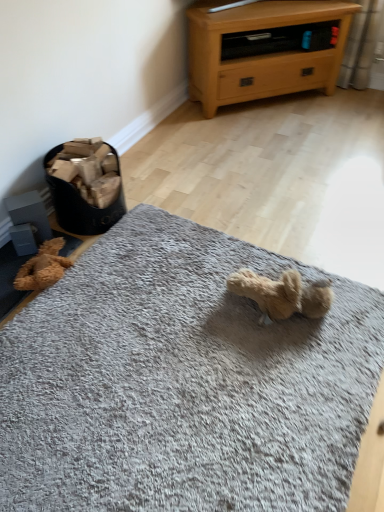
The width and height of the screenshot is (384, 512). I want to click on vacant space that's between light oak wood chest of drawers at upper right and brown plush teddy bear at lower left, so click(x=208, y=145).